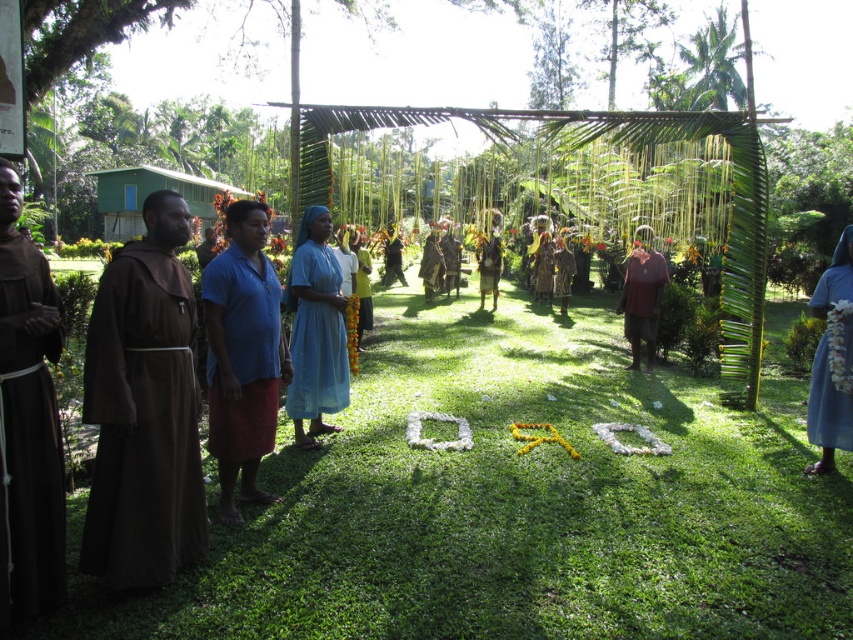
Question: Is the position of light blue fabric dress at center more distant than that of textured brown skirt at center?

Choices:
 (A) yes
 (B) no

Answer: (B)

Question: Is blue fabric at center wider than maroon fabric robe at center?

Choices:
 (A) yes
 (B) no

Answer: (B)

Question: Can you confirm if brown woolen robe at left is positioned to the right of black matte robe at center?

Choices:
 (A) no
 (B) yes

Answer: (A)

Question: Which point is farther to the camera?

Choices:
 (A) yellow fabric at center
 (B) green grass at center
 (C) brown fabric robe at center

Answer: (C)

Question: Which object appears farthest from the camera in this image?

Choices:
 (A) light blue fabric dress at center
 (B) black matte robe at center
 (C) green grass at center

Answer: (B)

Question: Among these objects, which one is farthest from the camera?

Choices:
 (A) blue fabric skirt at center
 (B) yellow fabric at center

Answer: (B)